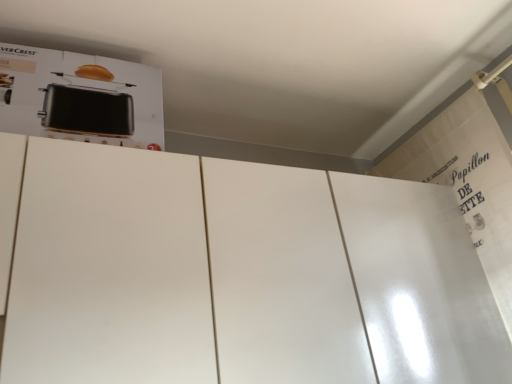
Question: Looking at the image, does white glossy door at upper right seem bigger or smaller compared to black metallic toaster at upper left?

Choices:
 (A) small
 (B) big

Answer: (B)

Question: Is white glossy door at upper right inside the boundaries of black metallic toaster at upper left, or outside?

Choices:
 (A) inside
 (B) outside

Answer: (B)

Question: Is point (495, 329) closer or farther from the camera than point (104, 122)?

Choices:
 (A) farther
 (B) closer

Answer: (A)

Question: Based on their positions, is black metallic toaster at upper left located to the left or right of white glossy door at upper right?

Choices:
 (A) left
 (B) right

Answer: (A)

Question: From the image's perspective, is black metallic toaster at upper left above or below white glossy door at upper right?

Choices:
 (A) above
 (B) below

Answer: (A)

Question: Relative to white glossy door at upper right, is black metallic toaster at upper left in front or behind?

Choices:
 (A) behind
 (B) front

Answer: (B)

Question: In terms of size, does black metallic toaster at upper left appear bigger or smaller than white glossy door at upper right?

Choices:
 (A) small
 (B) big

Answer: (A)